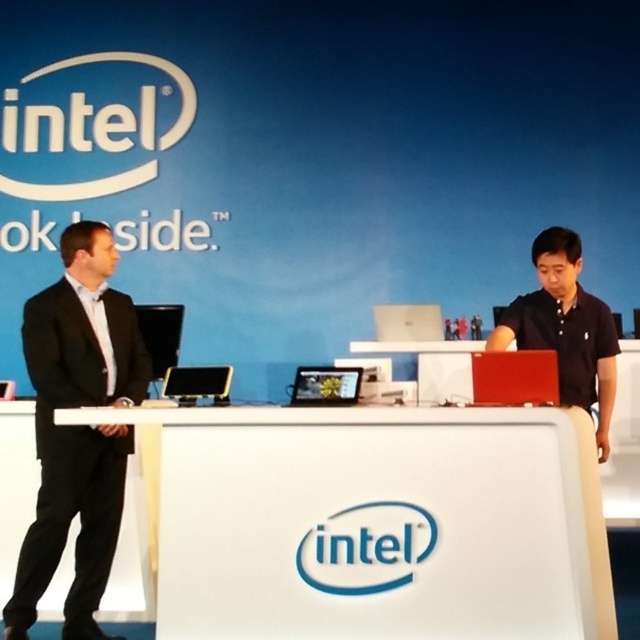
Question: Can you confirm if white plastic information desk at center is thinner than silver metallic laptop at center?

Choices:
 (A) no
 (B) yes

Answer: (A)

Question: Can you confirm if black suit at left is positioned below matte red laptop at center?

Choices:
 (A) yes
 (B) no

Answer: (A)

Question: Estimate the real-world distances between objects in this image. Which object is closer to the matte silver tablet at center?

Choices:
 (A) matte black shirt at center
 (B) black suit at left
 (C) white glossy table at center

Answer: (A)

Question: Does white plastic information desk at center have a smaller size compared to black suit at left?

Choices:
 (A) no
 (B) yes

Answer: (B)

Question: Among these points, which one is nearest to the camera?

Choices:
 (A) (349, 387)
 (B) (81, 257)
 (C) (397, 346)

Answer: (A)

Question: Which object appears farthest from the camera in this image?

Choices:
 (A) white plastic information desk at center
 (B) black suit at left
 (C) matte red laptop at center

Answer: (B)